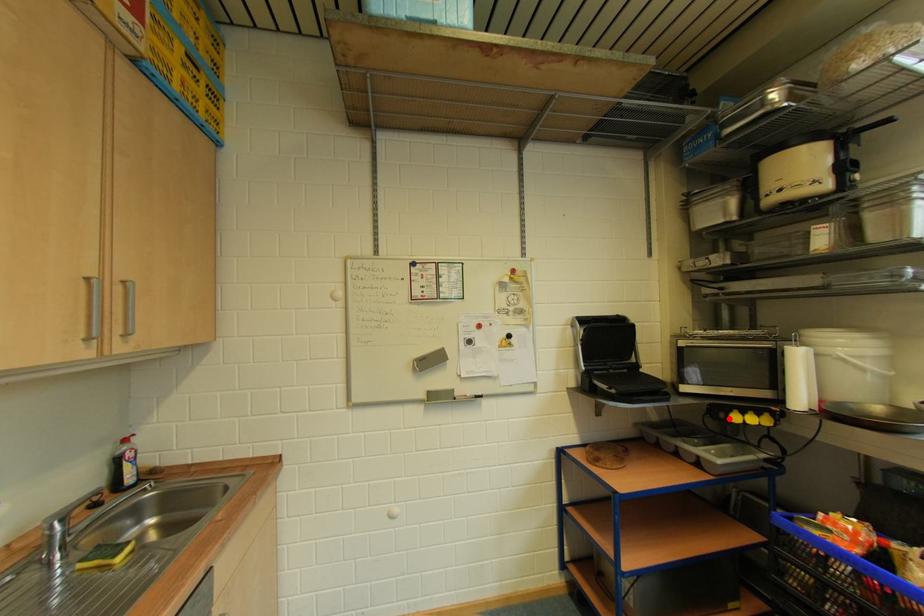
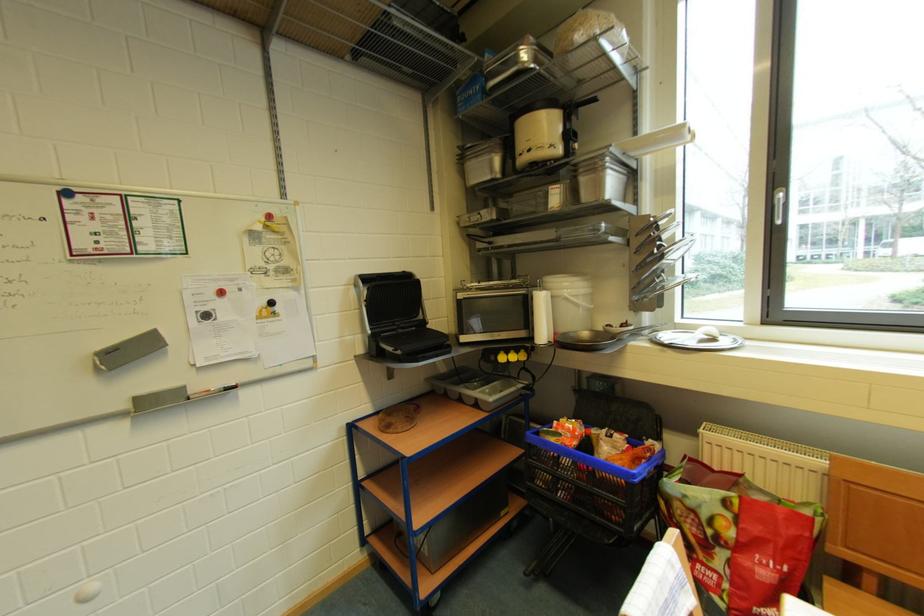
Find the pixel in the second image that matches the highlighted location in the first image.

(500, 361)